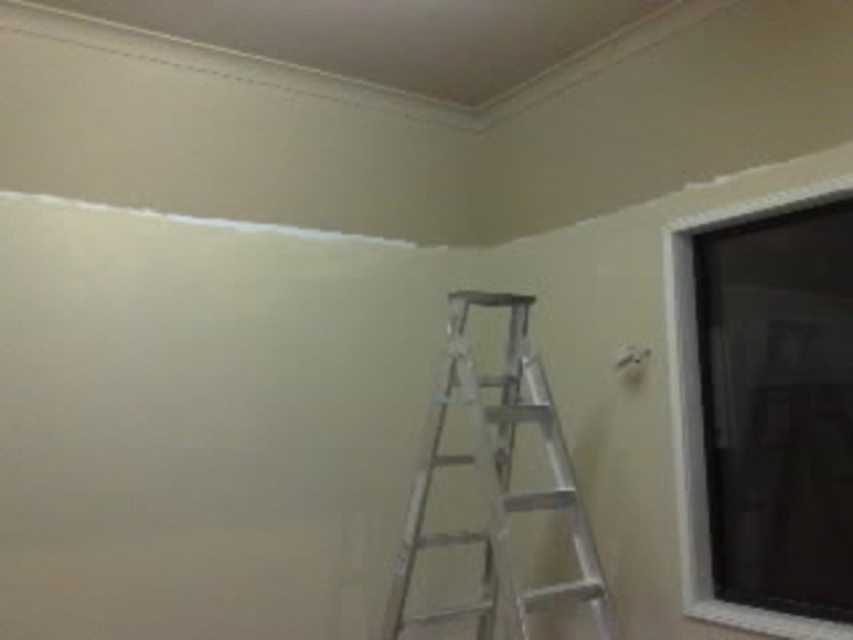
You are a painter who needs to reach the highest point of the clear glass window at upper right. Given the silver metallic ladder at center, can you estimate if the ladder is tall enough to reach the top of the window?

The silver metallic ladder at center has a larger size compared to clear glass window at upper right, so the ladder is likely tall enough to reach the top of the window.

You are a painter who needs to move a painting tool from the silver metallic ladder at center to the clear glass window at upper right. Considering their sizes, which object will be easier to maneuver around?

The clear glass window at upper right will be easier to maneuver around since it is narrower than the silver metallic ladder at center.